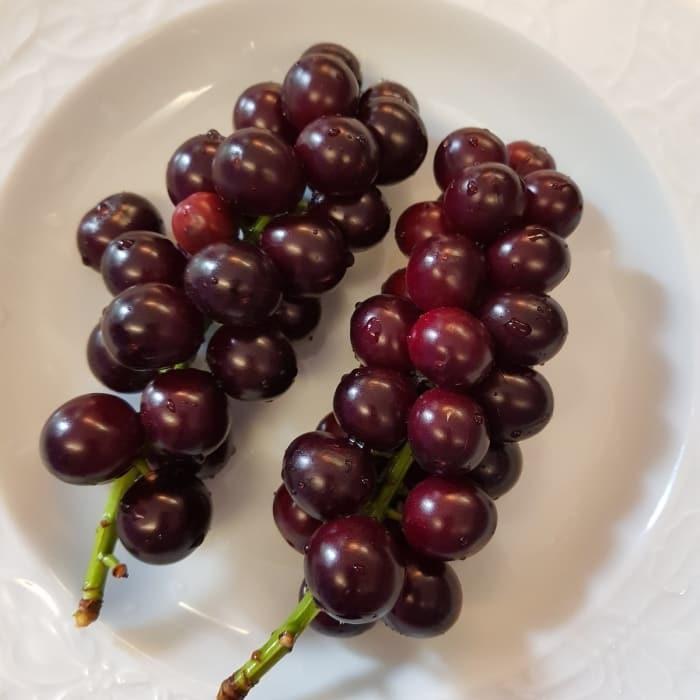
The height and width of the screenshot is (700, 700). I want to click on white bowl, so click(48, 295).